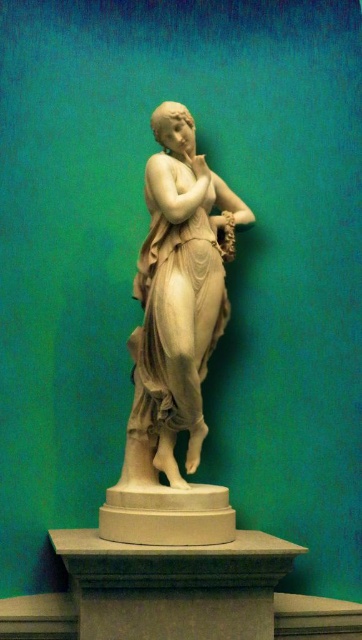
In the scene shown: You are an art curator planning to move the white marble statue at center and the smooth stone pedestal at center to a new gallery. If the pedestal is currently supporting the statue, which object should you move first to ensure safe transportation?

The smooth stone pedestal at center should be moved first because the white marble statue at center is larger in size and likely heavier, so moving the pedestal first allows the statue to be placed onto it safely.

You are an art conservator standing 2 meters away from the white marble statue at center. You need to reach a maintenance tool that is placed 1.2 meters behind you. Can you safely retrieve it without moving closer to the statue?

The distance between you and the white marble statue at center is 3.22 meters. Since the tool is 1.2 meters behind you, you have enough space to turn around and retrieve it without getting closer to the statue.

You are an art curator planning to install a spotlight on the smooth stone pedestal at center. From the viewer perspective, will the spotlight be placed in front or behind the white marble statue at center?

The smooth stone pedestal at center is behind the white marble statue at center, so the spotlight should be placed behind the white marble statue at center to illuminate the pedestal.